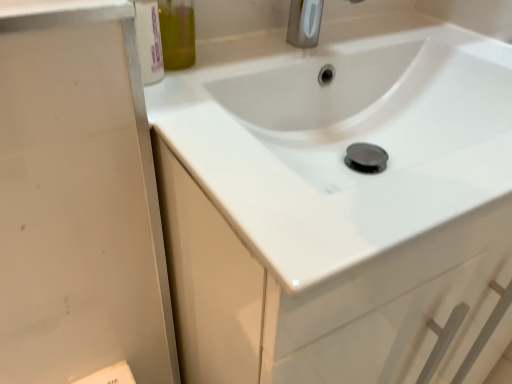
Where is `free location to the right of satin nickel faucet at upper center`? This screenshot has height=384, width=512. free location to the right of satin nickel faucet at upper center is located at coordinates (430, 34).